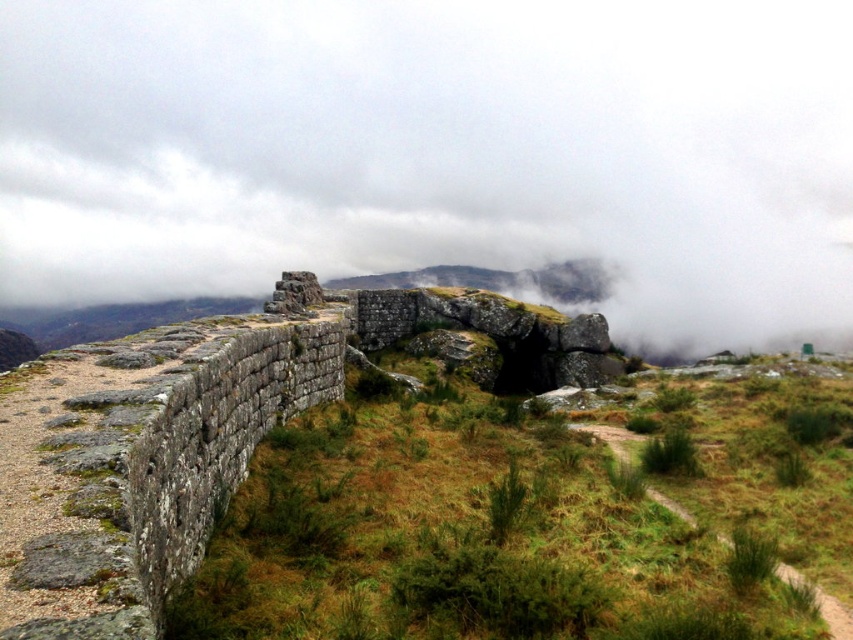
Can you confirm if white fluffy cloud at upper center is shorter than green grassy at left?

Incorrect, white fluffy cloud at upper center's height does not fall short of green grassy at left's.

Based on the photo, is white fluffy cloud at upper center positioned behind green grassy at left?

Yes, white fluffy cloud at upper center is behind green grassy at left.

Does point (456, 150) come farther from viewer compared to point (619, 557)?

Yes, point (456, 150) is farther from viewer.

This screenshot has width=853, height=640. I want to click on white fluffy cloud at upper center, so (x=437, y=150).

Does white fluffy cloud at upper center have a greater height compared to green grass at center?

Yes.

At what (x,y) coordinates should I click in order to perform the action: click on white fluffy cloud at upper center. Please return your answer as a coordinate pair (x, y). The image size is (853, 640). Looking at the image, I should click on (437, 150).

Who is more forward, (271, 65) or (659, 468)?

Point (659, 468) is more forward.

Find the location of `white fluffy cloud at upper center`. white fluffy cloud at upper center is located at coordinates (437, 150).

Can you confirm if brown dirt path at lower right is positioned below green grass at center?

Indeed, brown dirt path at lower right is positioned under green grass at center.

Can you confirm if brown dirt path at lower right is positioned to the left of green grass at center?

Indeed, brown dirt path at lower right is positioned on the left side of green grass at center.

Locate an element on the screen. The height and width of the screenshot is (640, 853). brown dirt path at lower right is located at coordinates [819, 602].